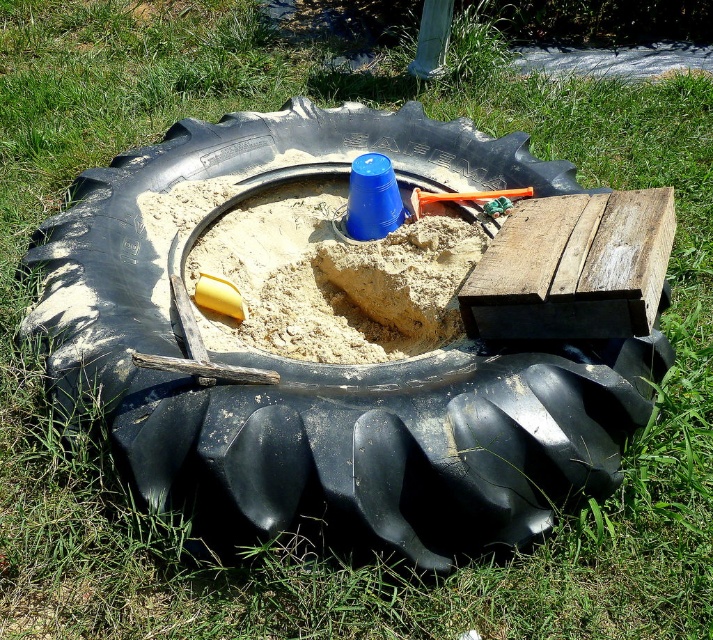
Based on the photo, is black rubber tire at center to the right of sandy yellow sand at center from the viewer's perspective?

Indeed, black rubber tire at center is positioned on the right side of sandy yellow sand at center.

Who is positioned more to the right, black rubber tire at center or sandy yellow sand at center?

black rubber tire at center is more to the right.

Who is more distant from viewer, (220, 145) or (282, 353)?

Point (220, 145)

Locate an element on the screen. black rubber tire at center is located at coordinates (334, 365).